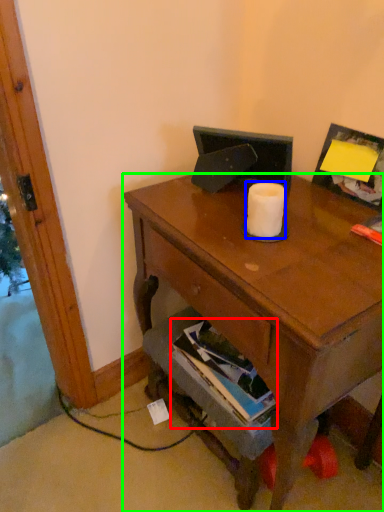
Question: Considering the real-world distances, which object is closest to book (highlighted by a red box)? toilet paper (highlighted by a blue box) or desk (highlighted by a green box).

Choices:
 (A) toilet paper
 (B) desk

Answer: (B)